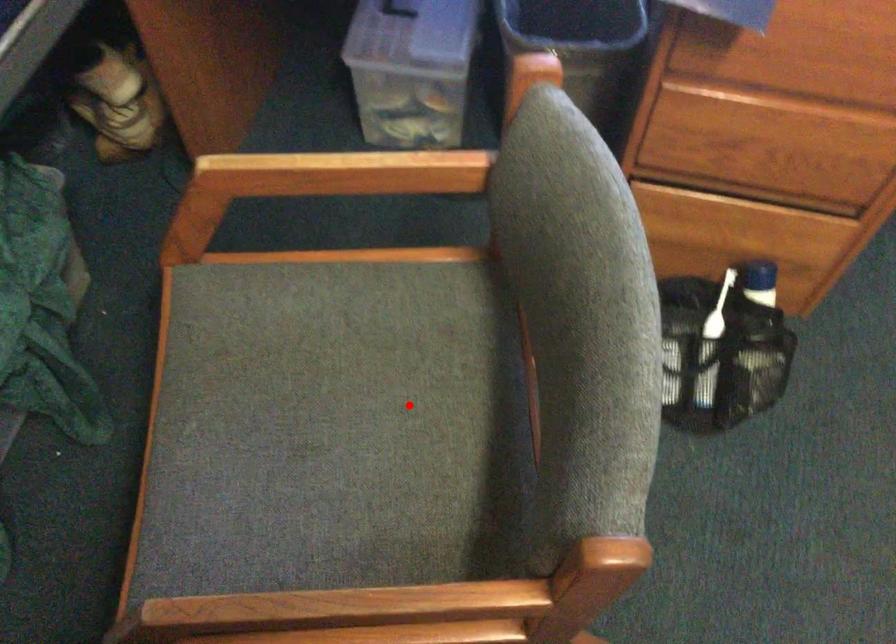
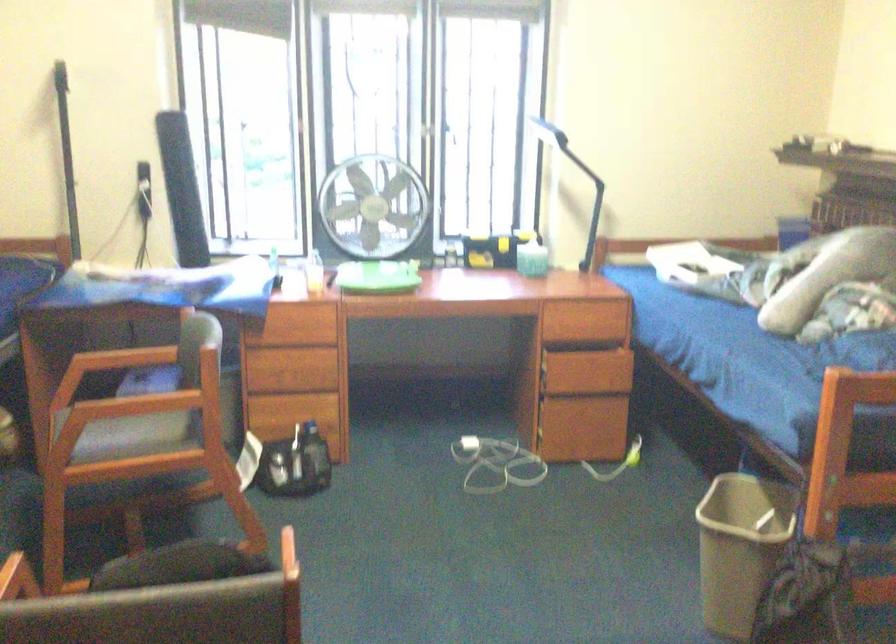
Question: A red point is marked in image1. In image2, is the corresponding 3D point closer to the camera or farther? Reply with the corresponding letter.

Choices:
 (A) The corresponding 3D point is closer.
 (B) The corresponding 3D point is farther.

Answer: (B)